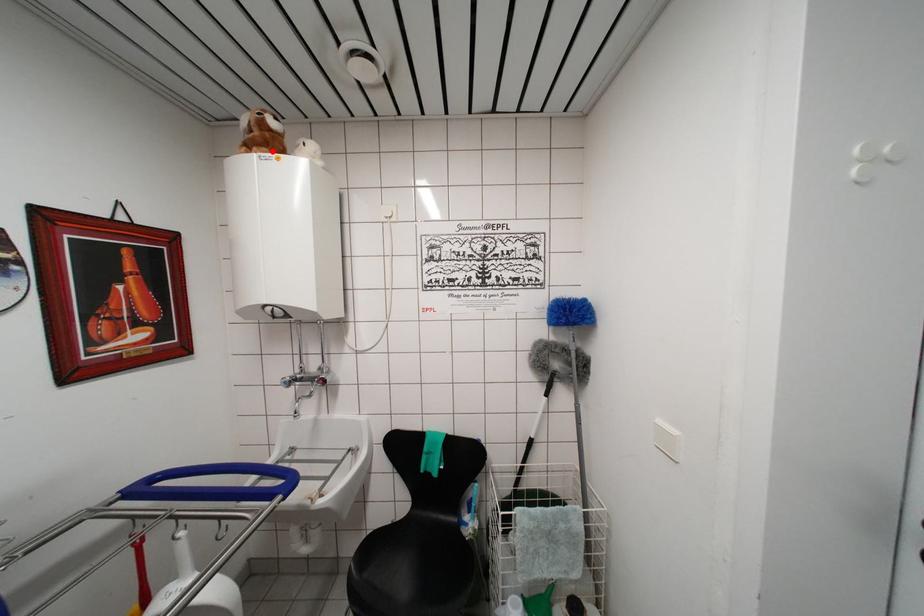
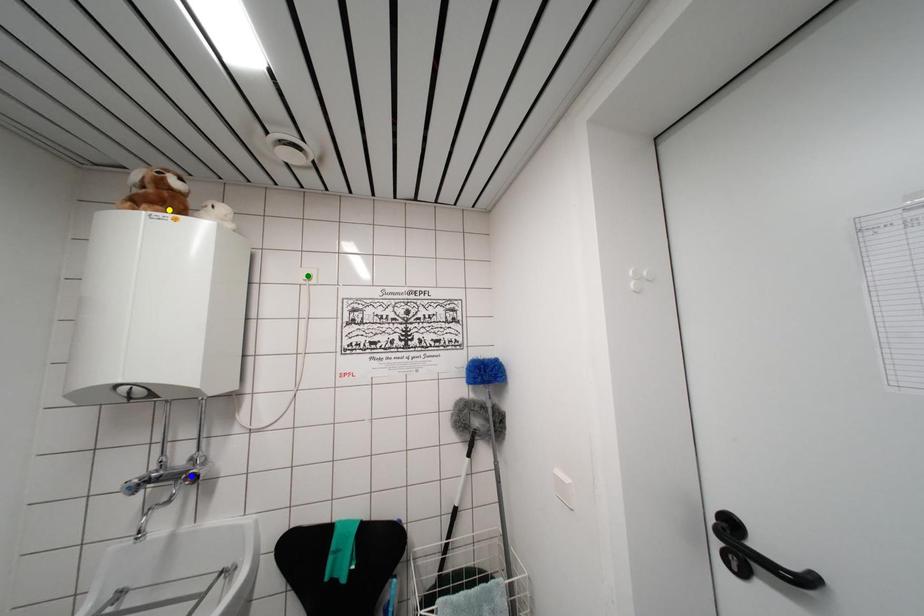
Question: I am providing you with two images of the same scene from different viewpoints. A red point is marked on the first image. You are given multiple points on the second image. Which mark in image 2 goes with the point in image 1?

Choices:
 (A) yellow point
 (B) blue point
 (C) green point

Answer: (A)